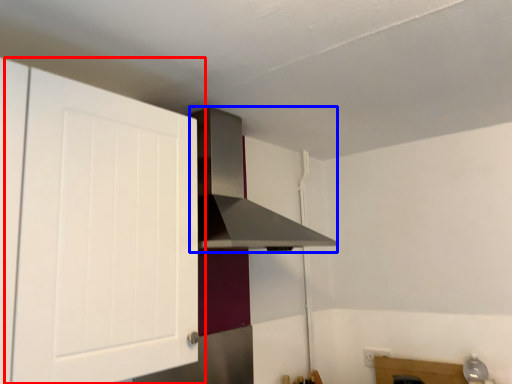
Question: Which object appears closest to the camera in this image, cabinetry (highlighted by a red box) or vent (highlighted by a blue box)?

Choices:
 (A) cabinetry
 (B) vent

Answer: (A)